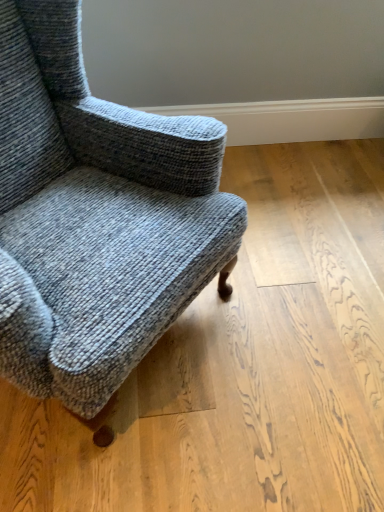
Where is `vacant area that is situated to the right of textured gray armchair at center`? Image resolution: width=384 pixels, height=512 pixels. vacant area that is situated to the right of textured gray armchair at center is located at coordinates (296, 312).